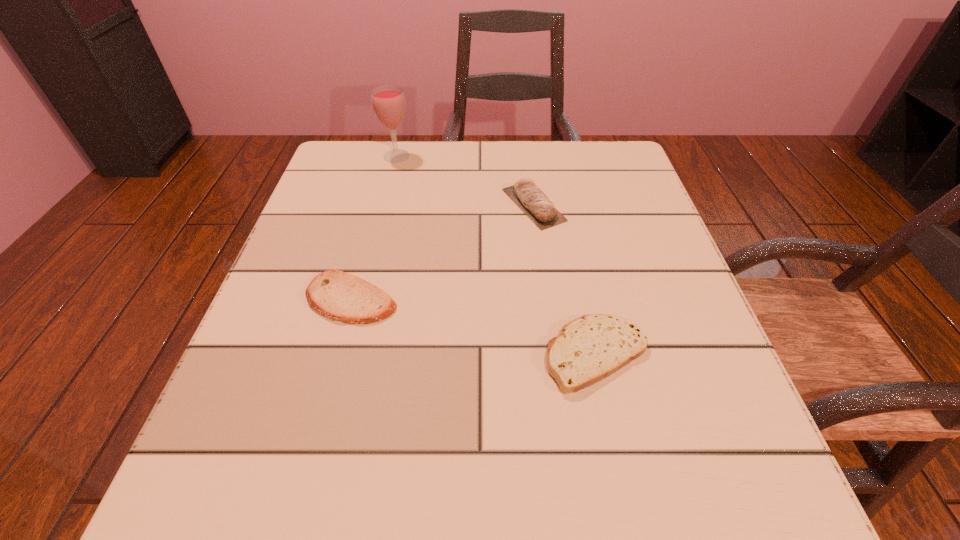
This screenshot has width=960, height=540. In the image, there is a desktop. What are the coordinates of `blank space at the far right corner` in the screenshot? It's located at (598, 148).

This screenshot has height=540, width=960. Identify the location of vacant space that's between the tallest object and the leftmost pita bread. tap(373, 228).

Where is `unoccupied position between the leftmost pita bread and the wineglass`? The height and width of the screenshot is (540, 960). unoccupied position between the leftmost pita bread and the wineglass is located at coordinates (373, 228).

You are a GUI agent. You are given a task and a screenshot of the screen. Output one action in this format:
    pyautogui.click(x=<x>, y=<y>)
    Task: Click on the free area in between the leftmost pita bread and the farthest pita bread
    The width and height of the screenshot is (960, 540).
    Given the screenshot: What is the action you would take?
    pyautogui.click(x=443, y=252)

Where is `vacant area that lies between the farthest pita bread and the leftmost pita bread`? vacant area that lies between the farthest pita bread and the leftmost pita bread is located at coordinates (443, 252).

Identify which object is the second nearest to the third shortest object. Please provide its 2D coordinates. Your answer should be formatted as a tuple, i.e. [(x, y)], where the tuple contains the x and y coordinates of a point satisfying the conditions above.

[(388, 101)]

Select which object is the second closest to the leftmost pita bread. Please provide its 2D coordinates. Your answer should be formatted as a tuple, i.e. [(x, y)], where the tuple contains the x and y coordinates of a point satisfying the conditions above.

[(593, 347)]

Locate an element on the screen. The height and width of the screenshot is (540, 960). pita bread that stands as the closest to the farthest object is located at coordinates (527, 196).

Select which pita bread appears as the third closest to the wineglass. Please provide its 2D coordinates. Your answer should be formatted as a tuple, i.e. [(x, y)], where the tuple contains the x and y coordinates of a point satisfying the conditions above.

[(593, 347)]

You are a GUI agent. You are given a task and a screenshot of the screen. Output one action in this format:
    pyautogui.click(x=<x>, y=<y>)
    Task: Click on the vacant region that satisfies the following two spatial constraints: 1. on the front side of the wineglass; 2. on the left side of the third nearest object
    
    Given the screenshot: What is the action you would take?
    pyautogui.click(x=385, y=205)